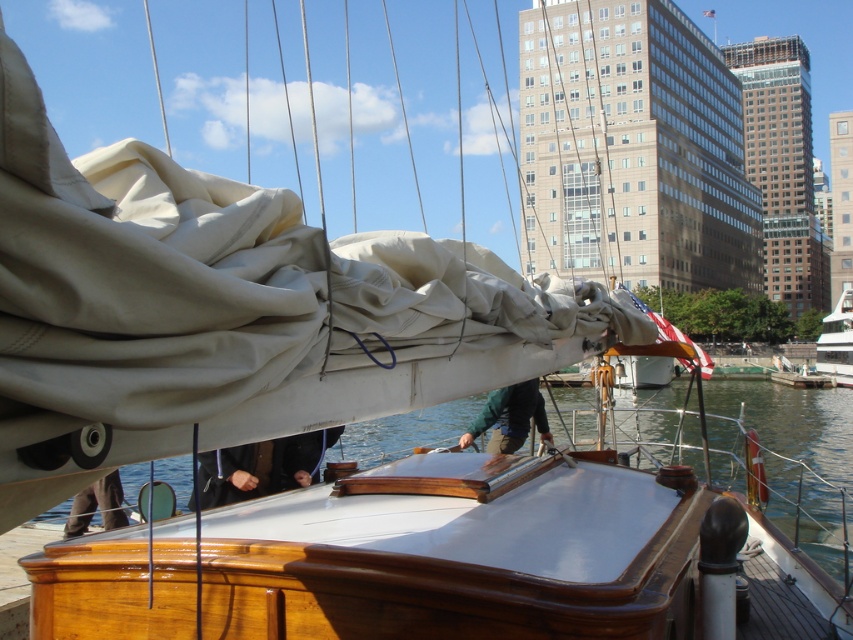
You are a sailor on the deck of the boat. You need to secure the dark gray fabric at lower center so it doesn t blow away in the wind. The white glossy yacht at right is in your way. Can you move around it to reach the fabric?

The white glossy yacht at right is taller than the dark gray fabric at lower center, so you can move around it to reach the fabric as long as you can navigate past its height.

You are a sailor trying to secure the dark gray fabric at lower center to the white glossy yacht at right. Based on their widths, can you determine if the fabric will cover the entire width of the yacht?

The white glossy yacht at right might be wider than dark gray fabric at lower center, so there is a possibility that the fabric will not cover the entire width of the yacht.